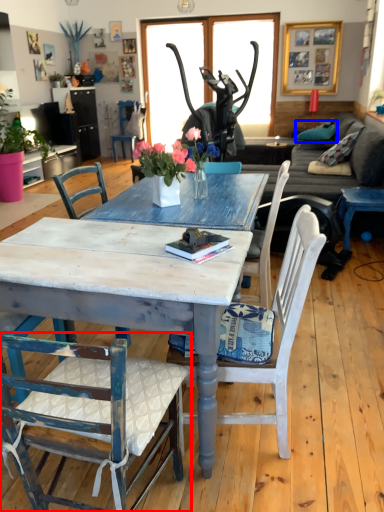
Question: Among these objects, which one is nearest to the camera, chair (highlighted by a red box) or pillow (highlighted by a blue box)?

Choices:
 (A) chair
 (B) pillow

Answer: (A)